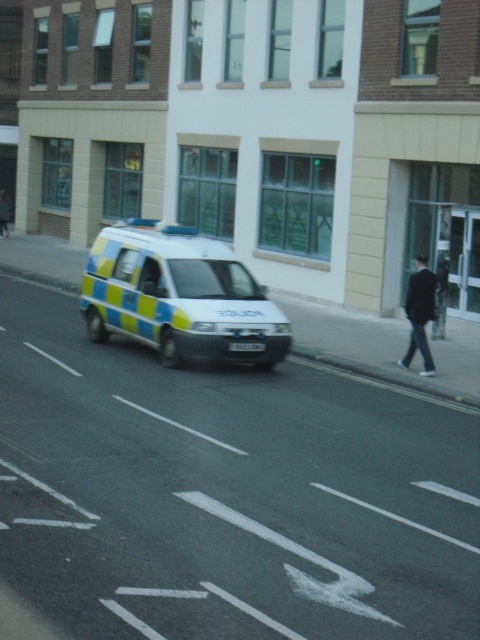
Does blue and yellow painted van at center appear under dark blue fabric jacket at right?

Yes, blue and yellow painted van at center is below dark blue fabric jacket at right.

What do you see at coordinates (179, 296) in the screenshot? I see `blue and yellow painted van at center` at bounding box center [179, 296].

Locate an element on the screen. Image resolution: width=480 pixels, height=640 pixels. blue and yellow painted van at center is located at coordinates (179, 296).